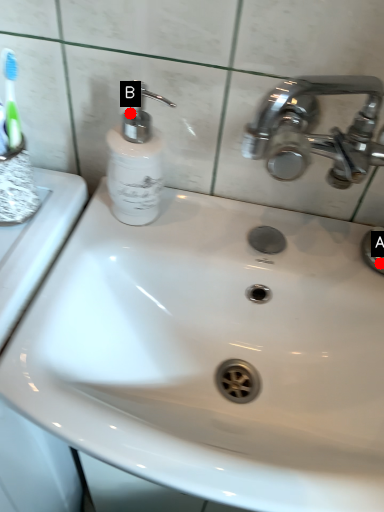
Question: Two points are circled on the image, labeled by A and B beside each circle. Which point appears farthest from the camera in this image?

Choices:
 (A) A is further
 (B) B is further

Answer: (A)